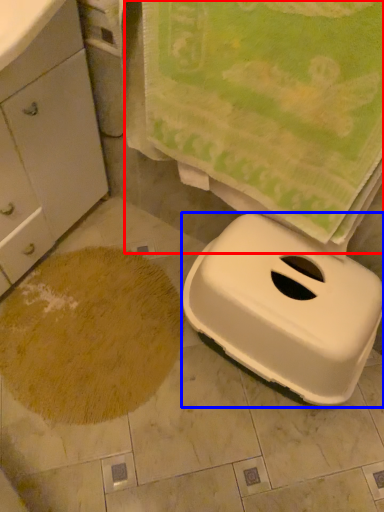
Question: Which object appears closest to the camera in this image, beach towel (highlighted by a red box) or appliance (highlighted by a blue box)?

Choices:
 (A) beach towel
 (B) appliance

Answer: (A)